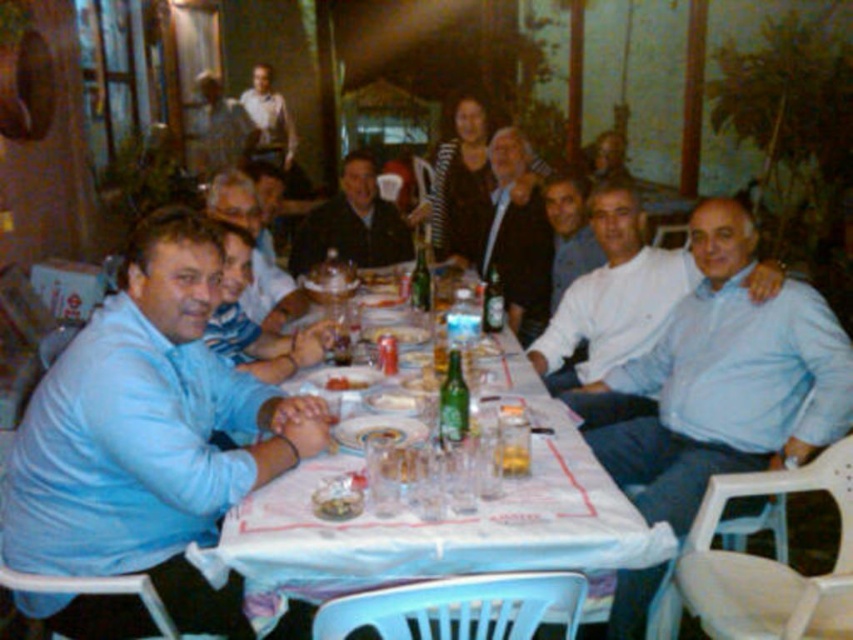
You are a photographer trying to capture a group photo of the people at the table. You notice the light blue shirt at right and the clear glass water at center. Which object is wider when viewed from above?

The light blue shirt at right is wider than the clear glass water at center.

You are sitting at the table in the image and want to reach for an item located at point (538,353). Is this point closer to you than the other point (265,124)?

Yes, the point (538,353) is in front of point (265,124), so it is closer to you.